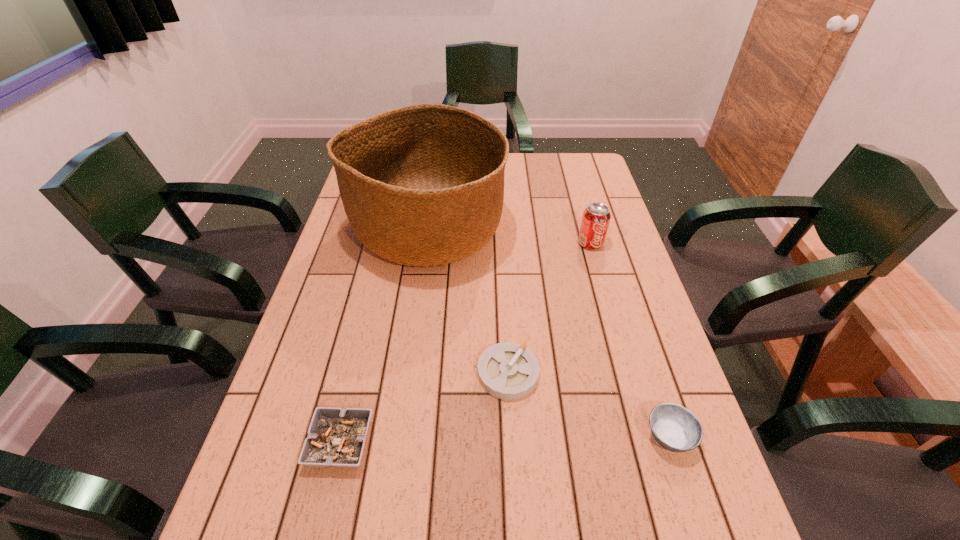
Where is `vacant space located on the left of the third nearest object`? vacant space located on the left of the third nearest object is located at coordinates (391, 373).

The height and width of the screenshot is (540, 960). I want to click on free space located on the right of the leftmost ashtray, so click(x=459, y=443).

Image resolution: width=960 pixels, height=540 pixels. Find the location of `object positioned at the far edge`. object positioned at the far edge is located at coordinates (422, 185).

Identify the location of basket that is at the left edge. This screenshot has height=540, width=960. (422, 185).

The width and height of the screenshot is (960, 540). In order to click on ashtray present at the left edge in this screenshot , I will do `click(336, 437)`.

I want to click on soda can present at the right edge, so click(596, 217).

The height and width of the screenshot is (540, 960). In order to click on ashtray located at the right edge in this screenshot , I will do `click(675, 428)`.

I want to click on object that is at the far left corner, so click(422, 185).

In the image, there is a desktop. At what (x,y) coordinates should I click in order to perform the action: click on vacant region at the left edge. Please return your answer as a coordinate pair (x, y). This screenshot has width=960, height=540. Looking at the image, I should click on (294, 376).

In the image, there is a desktop. At what (x,y) coordinates should I click in order to perform the action: click on vacant space at the right edge. Please return your answer as a coordinate pair (x, y). Looking at the image, I should click on (631, 264).